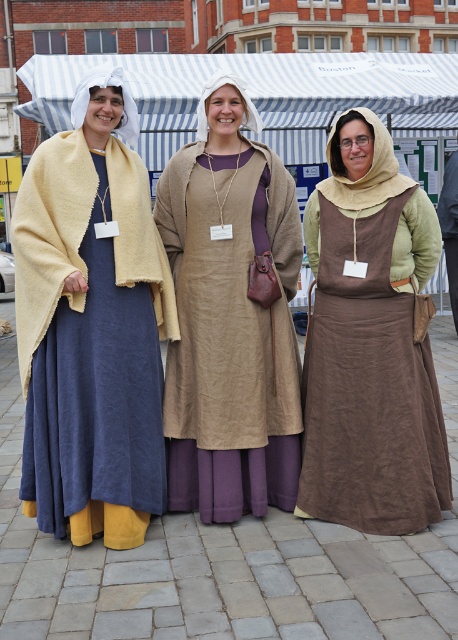
Question: Which point is farther to the camera?

Choices:
 (A) matte beige tunic at center
 (B) brown linen apron at center

Answer: (A)

Question: Which object is the closest to the matte yellow shawl at left?

Choices:
 (A) brown linen apron at center
 (B) matte beige tunic at center

Answer: (B)

Question: In this image, where is matte beige tunic at center located relative to brown linen apron at center?

Choices:
 (A) below
 (B) above

Answer: (B)

Question: Among these points, which one is farthest from the camera?

Choices:
 (A) (52, 497)
 (B) (227, 408)
 (C) (415, 269)

Answer: (C)

Question: Where is matte beige tunic at center located in relation to brown linen apron at center in the image?

Choices:
 (A) right
 (B) left

Answer: (B)

Question: Can you confirm if matte yellow shawl at left is smaller than brown linen apron at center?

Choices:
 (A) yes
 (B) no

Answer: (B)